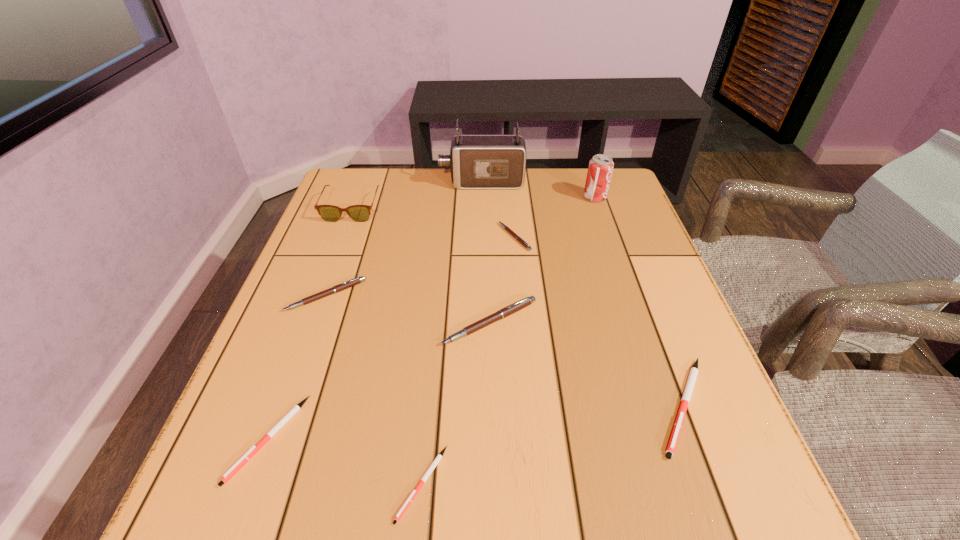
Image resolution: width=960 pixels, height=540 pixels. Identify the location of blank space located at the front view of the seventh shortest object. click(326, 277).

The width and height of the screenshot is (960, 540). I want to click on free region located at the nib of the biggest pink pen, so click(x=492, y=393).

I want to click on blank space located 0.120m at the nib of the leftmost pink pen, so click(302, 360).

At what (x,y) coordinates should I click in order to perform the action: click on free space located on the clicker of the rightmost white pen. Please return your answer as a coordinate pair (x, y). This screenshot has height=540, width=960. Looking at the image, I should click on (721, 508).

You are a GUI agent. You are given a task and a screenshot of the screen. Output one action in this format:
    pyautogui.click(x=<x>, y=<y>)
    Task: Click on the blank space located at the nib of the smallest pink pen
    Image resolution: width=960 pixels, height=540 pixels.
    Given the screenshot: What is the action you would take?
    pyautogui.click(x=352, y=237)

Where is `vacant space located at the nib of the smallest pink pen`? This screenshot has height=540, width=960. vacant space located at the nib of the smallest pink pen is located at coordinates (392, 237).

At what (x,y) coordinates should I click in order to perform the action: click on vacant space positioned 0.080m at the nib of the smallest pink pen. Please return your answer as a coordinate pair (x, y). The image size is (960, 540). Looking at the image, I should click on (468, 237).

Locate an element on the screen. camcorder positioned at the far edge is located at coordinates (477, 161).

I want to click on soda can that is at the far edge, so click(600, 169).

The width and height of the screenshot is (960, 540). What are the coordinates of `spectacles at the far edge` in the screenshot? It's located at (360, 213).